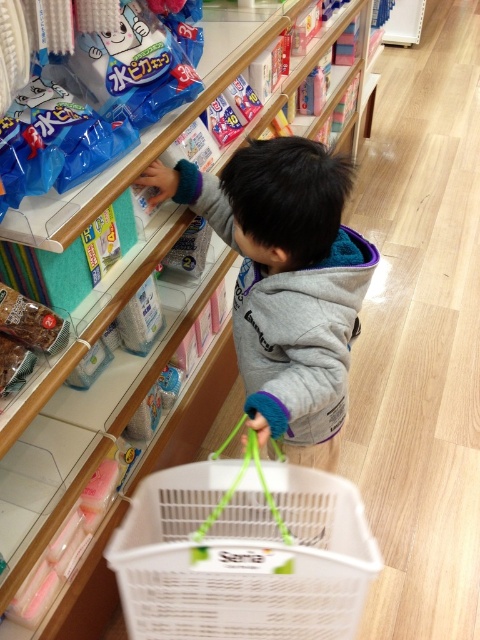
You are a delivery robot in the store. You need to deliver a package to the gray fleece sweatshirt at center. The brown textured snack at lower left is blocking the path. Can you navigate around it?

The gray fleece sweatshirt at center is 18.23 inches away from the brown textured snack at lower left, so the robot can navigate around the snack to reach the sweatshirt.

The child is trying to reach for the brown textured snack at lower left. Is the white plastic basket at lower center in the way?

The white plastic basket at lower center is closer to the viewer than the brown textured snack at lower left, so it is blocking the path to the snack.